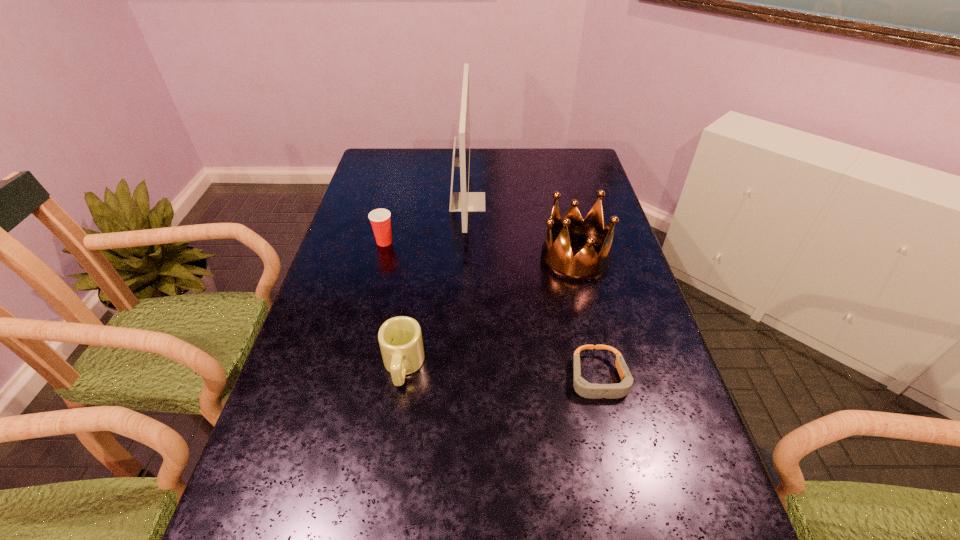
Where is `vacant area situated 0.050m on the front and back of the goggles`? The width and height of the screenshot is (960, 540). vacant area situated 0.050m on the front and back of the goggles is located at coordinates (611, 430).

Find the location of a particular element. This screenshot has height=540, width=960. object located in the far edge section of the desktop is located at coordinates (464, 201).

Identify the location of object present at the left edge. (380, 219).

What are the coordinates of `crown that is at the right edge` in the screenshot? It's located at (587, 265).

Find the location of a particular element. Image resolution: width=960 pixels, height=540 pixels. goggles located in the right edge section of the desktop is located at coordinates (x=582, y=387).

In the image, there is a desktop. Identify the location of vacant space at the far edge. Image resolution: width=960 pixels, height=540 pixels. (456, 156).

Identify the location of free location at the left edge. (314, 421).

Locate an element on the screen. The height and width of the screenshot is (540, 960). free space at the right edge is located at coordinates (623, 292).

Find the location of a particular element. free area in between the goggles and the monitor is located at coordinates (533, 291).

This screenshot has height=540, width=960. I want to click on vacant point located between the shortest object and the third object from right to left, so click(x=533, y=291).